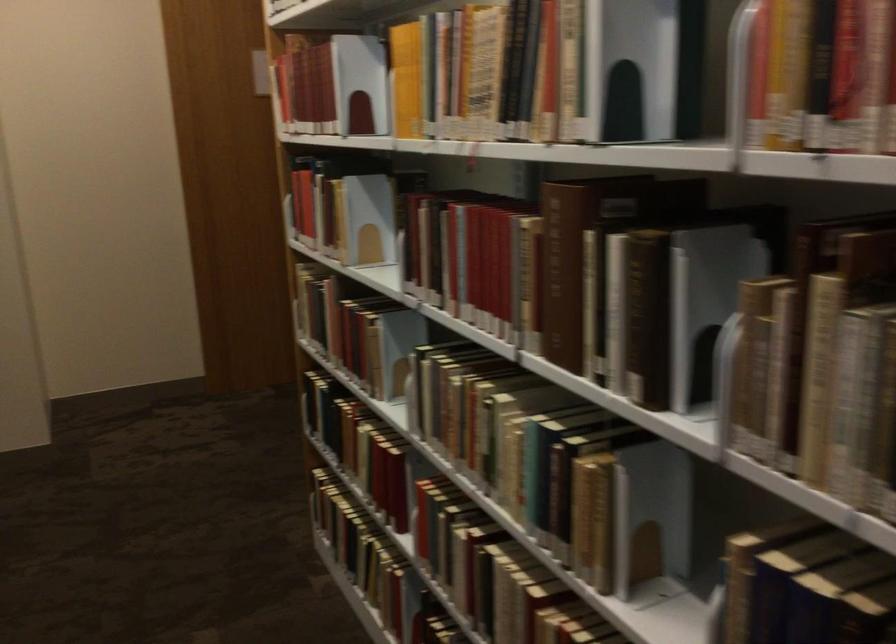
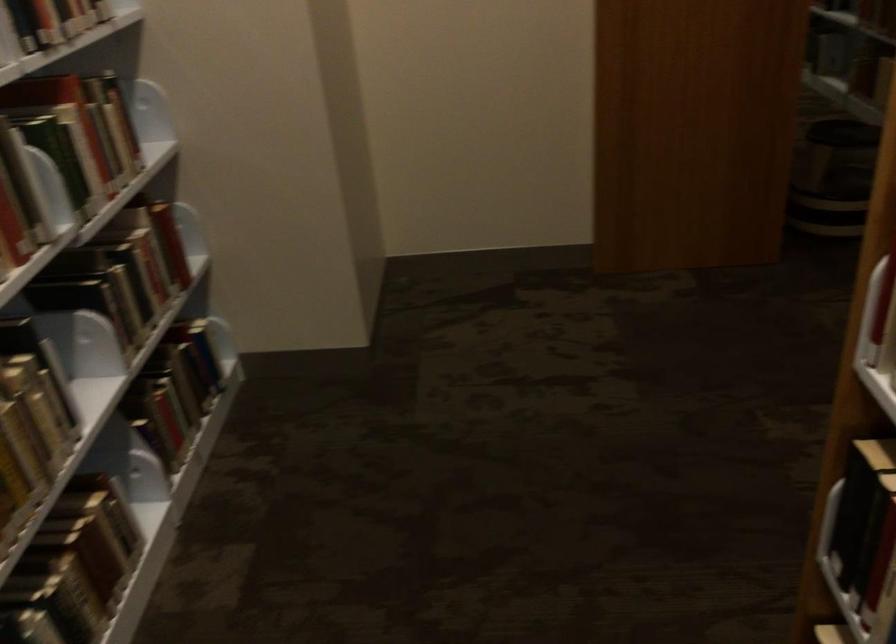
Locate, in the second image, the point that corresponds to the point at 307,413 in the first image.

(860, 545)